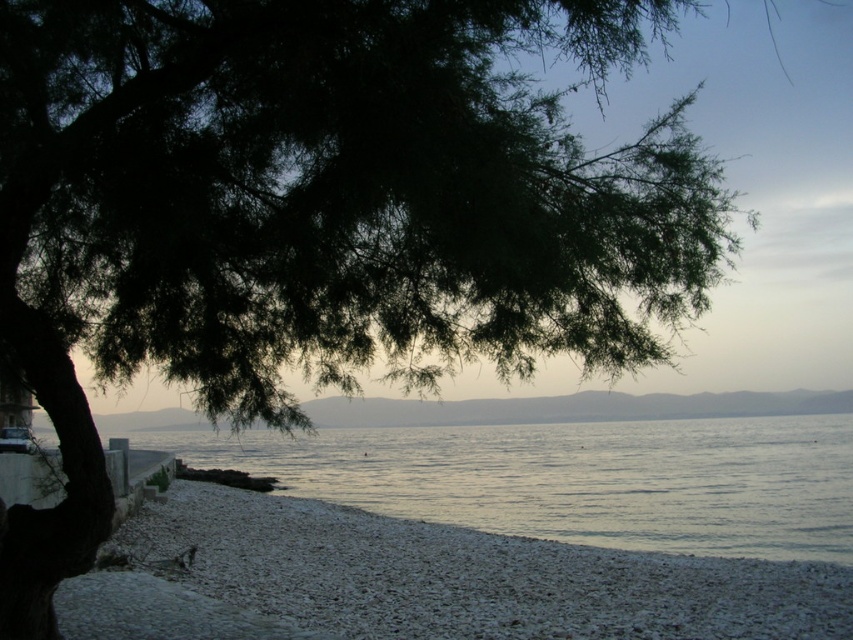
Is point (560, 570) more distant than point (666, 538)?

No, it is in front of (666, 538).

From the picture: Who is positioned more to the right, gray gravel beach at lower left or clear water at center?

clear water at center is more to the right.

Locate an element on the screen. The width and height of the screenshot is (853, 640). gray gravel beach at lower left is located at coordinates point(422,580).